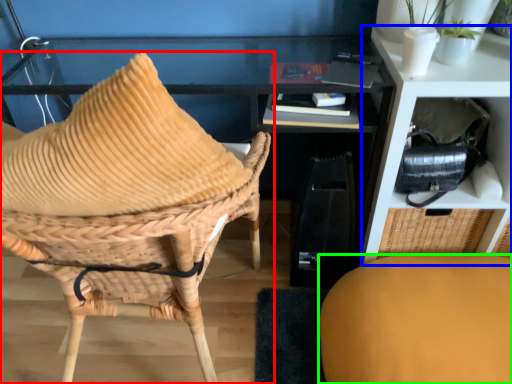
Question: Which object is positioned farthest from chair (highlighted by a red box)? Select from shelf (highlighted by a blue box) and chair (highlighted by a green box).

Choices:
 (A) shelf
 (B) chair

Answer: (A)